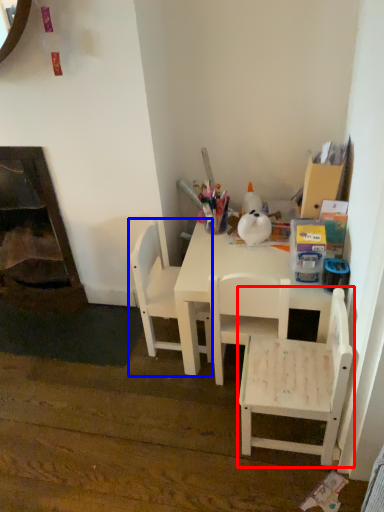
Question: Which point is closer to the camera, chair (highlighted by a red box) or chair (highlighted by a blue box)?

Choices:
 (A) chair
 (B) chair

Answer: (A)